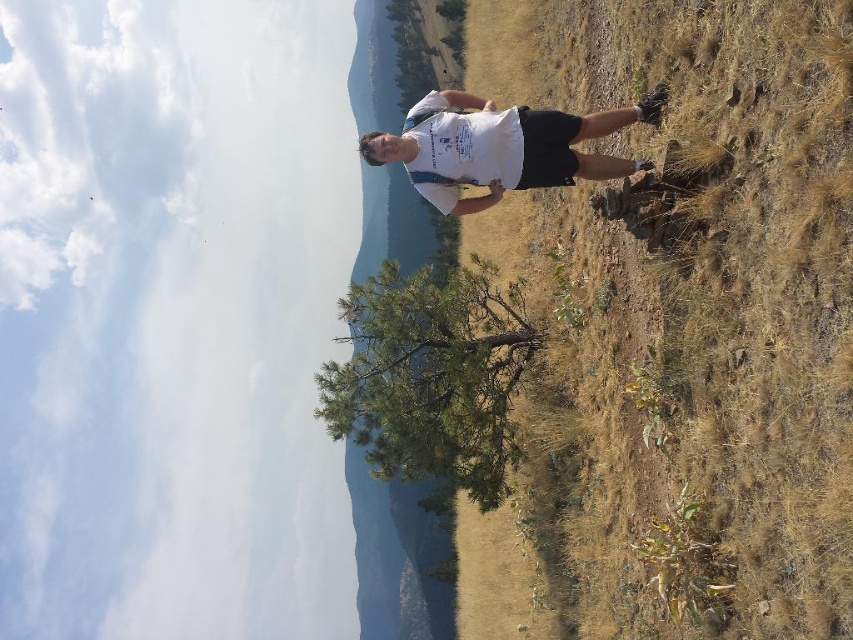
Does brown grass at right have a larger size compared to white cotton shirt at center?

No, brown grass at right is not bigger than white cotton shirt at center.

Does brown grass at right have a smaller size compared to white cotton shirt at center?

Correct, brown grass at right occupies less space than white cotton shirt at center.

This screenshot has height=640, width=853. Describe the element at coordinates (704, 296) in the screenshot. I see `brown grass at right` at that location.

At what (x,y) coordinates should I click in order to perform the action: click on brown grass at right. Please return your answer as a coordinate pair (x, y). The height and width of the screenshot is (640, 853). Looking at the image, I should click on (704, 296).